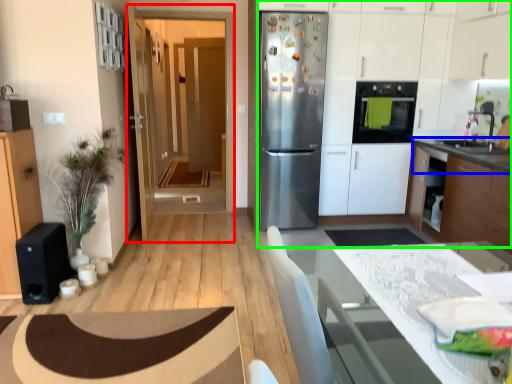
Question: Based on their relative distances, which object is farther from glass door (highlighted by a red box)? Choose from countertop (highlighted by a blue box) and dresser (highlighted by a green box).

Choices:
 (A) countertop
 (B) dresser

Answer: (A)